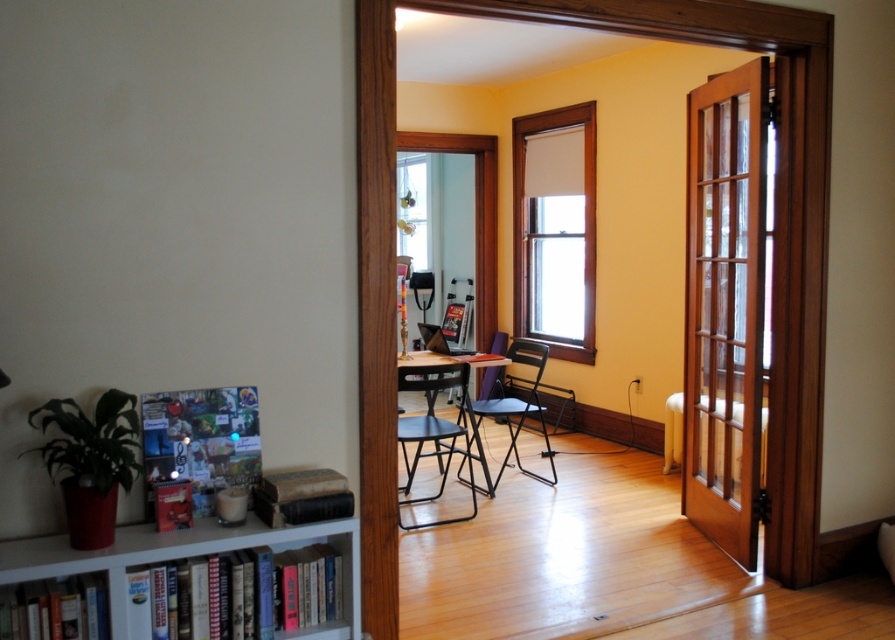
Does mahogany wood door at right lie in front of black metal chair at center?

Yes, mahogany wood door at right is in front of black metal chair at center.

Who is shorter, mahogany wood door at right or black metal chair at center?

black metal chair at center is shorter.

You are a GUI agent. You are given a task and a screenshot of the screen. Output one action in this format:
    pyautogui.click(x=<x>, y=<y>)
    Task: Click on the mahogany wood door at right
    The image size is (895, 640).
    Given the screenshot: What is the action you would take?
    pyautogui.click(x=723, y=307)

This screenshot has width=895, height=640. Identify the location of mahogany wood door at right. tap(723, 307).

Which is behind, point (761, 404) or point (245, 545)?

Positioned behind is point (761, 404).

Which is in front, point (710, 381) or point (118, 609)?

Point (118, 609)

This screenshot has width=895, height=640. I want to click on mahogany wood door at right, so click(723, 307).

Is wooden frame at center wider than blue fabric chair at center?

Incorrect, wooden frame at center's width does not surpass blue fabric chair at center's.

Does wooden frame at center have a lesser height compared to blue fabric chair at center?

No, wooden frame at center is not shorter than blue fabric chair at center.

This screenshot has height=640, width=895. Describe the element at coordinates (557, 230) in the screenshot. I see `wooden frame at center` at that location.

Where is `wooden frame at center`? The image size is (895, 640). wooden frame at center is located at coordinates (x=557, y=230).